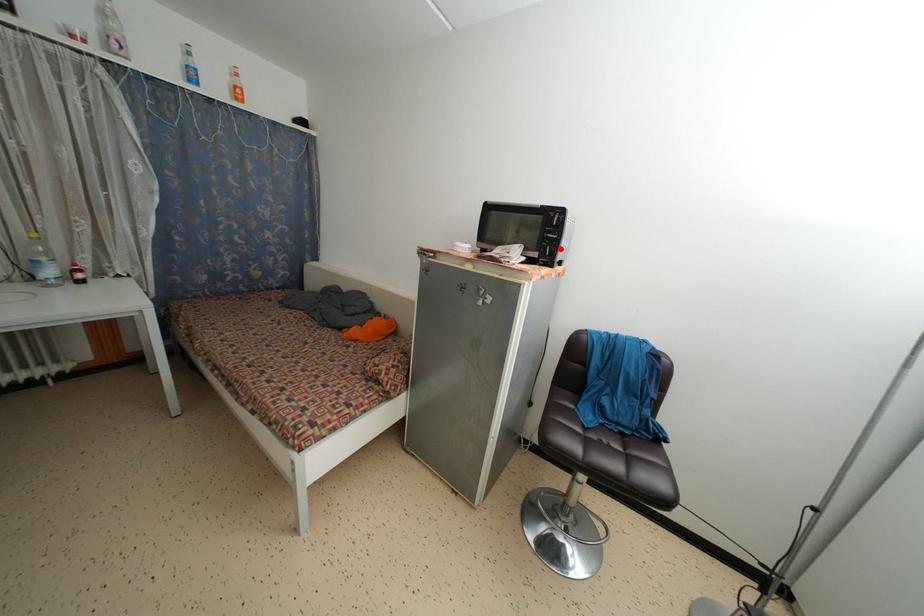
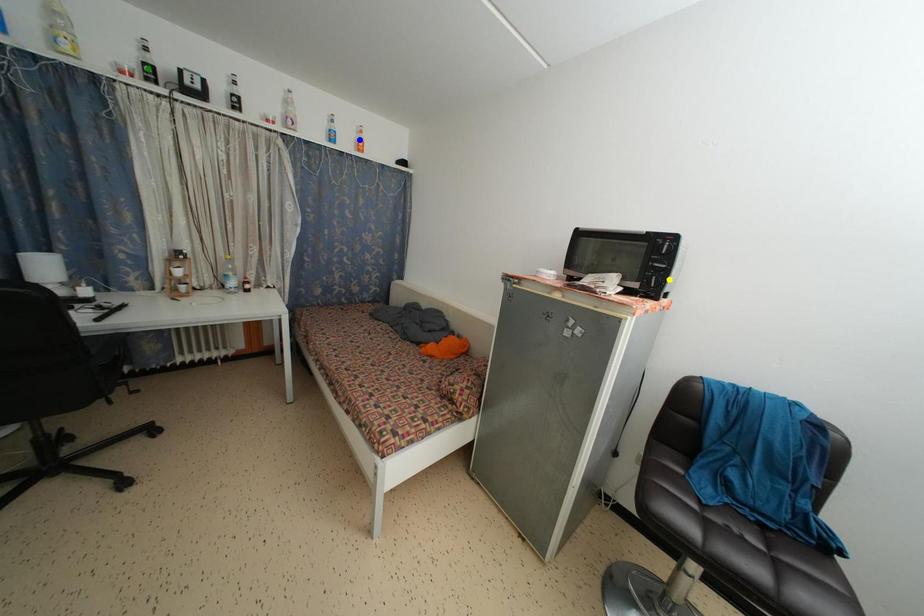
Question: I am providing you with two images of the same scene from different viewpoints. A red point is marked on the first image. You are given multiple points on the second image. Can you choose the point in image 2 that corresponds to the point in image 1?

Choices:
 (A) yellow point
 (B) blue point
 (C) green point

Answer: (A)